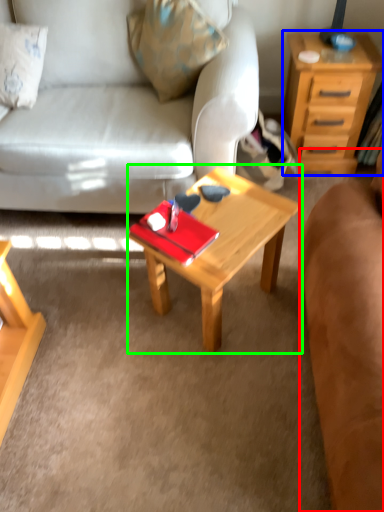
Question: Which is nearer to the studio couch (highlighted by a red box)? nightstand (highlighted by a blue box) or coffee table (highlighted by a green box).

Choices:
 (A) nightstand
 (B) coffee table

Answer: (B)